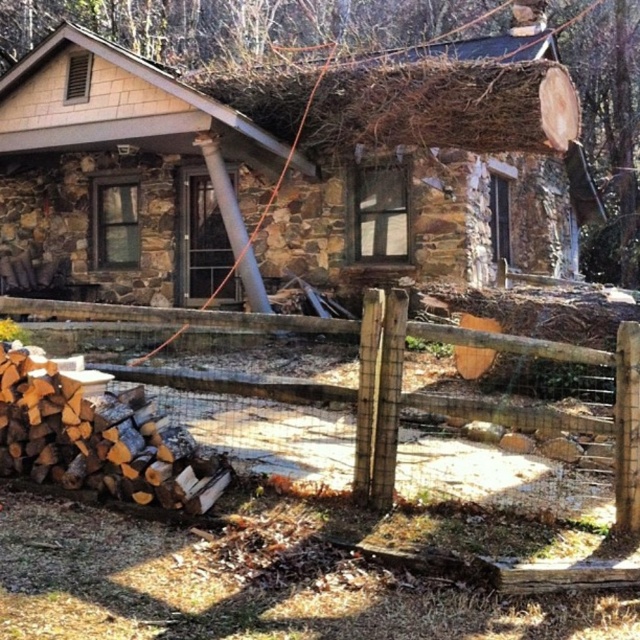
Is brown stone cabin at upper center further to camera compared to brown wooden fence at lower left?

That is True.

Where is `brown stone cabin at upper center`? The height and width of the screenshot is (640, 640). brown stone cabin at upper center is located at coordinates (282, 173).

Image resolution: width=640 pixels, height=640 pixels. I want to click on brown stone cabin at upper center, so click(x=282, y=173).